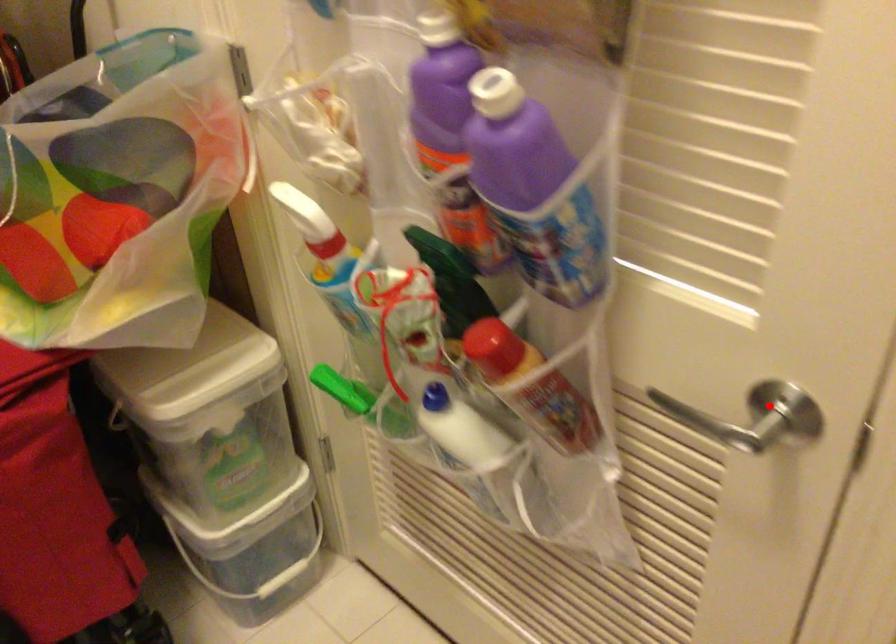
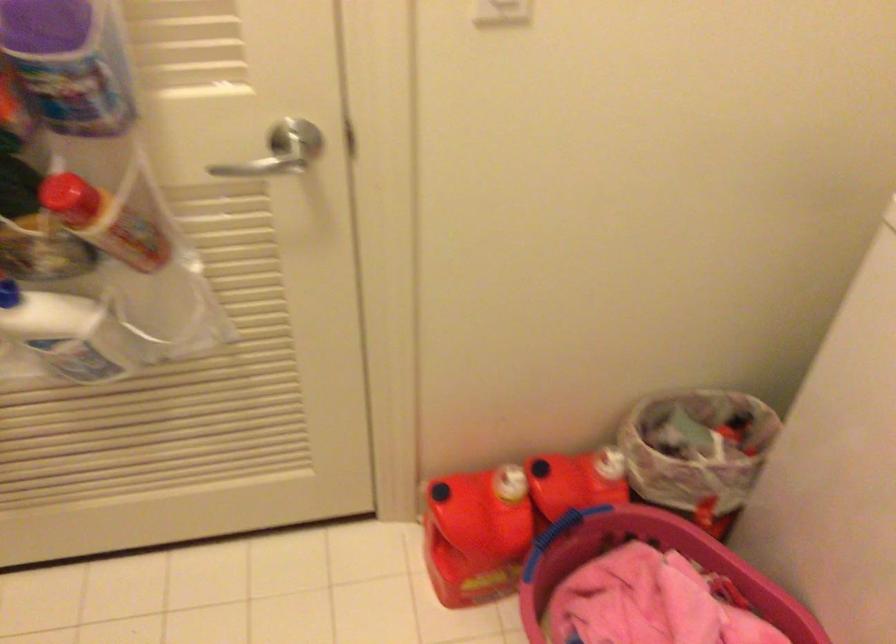
Find the pixel in the second image that matches the highlighted location in the first image.

(283, 137)